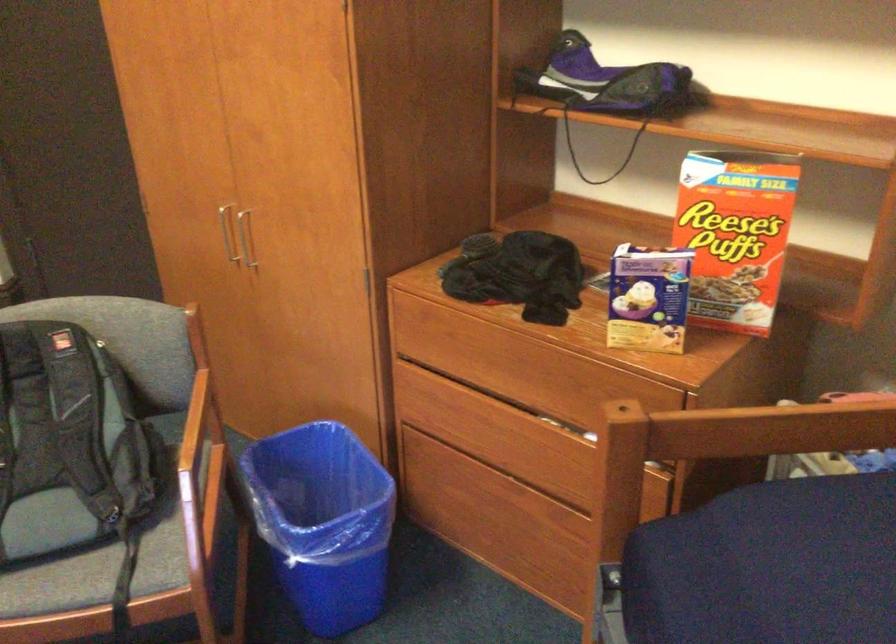
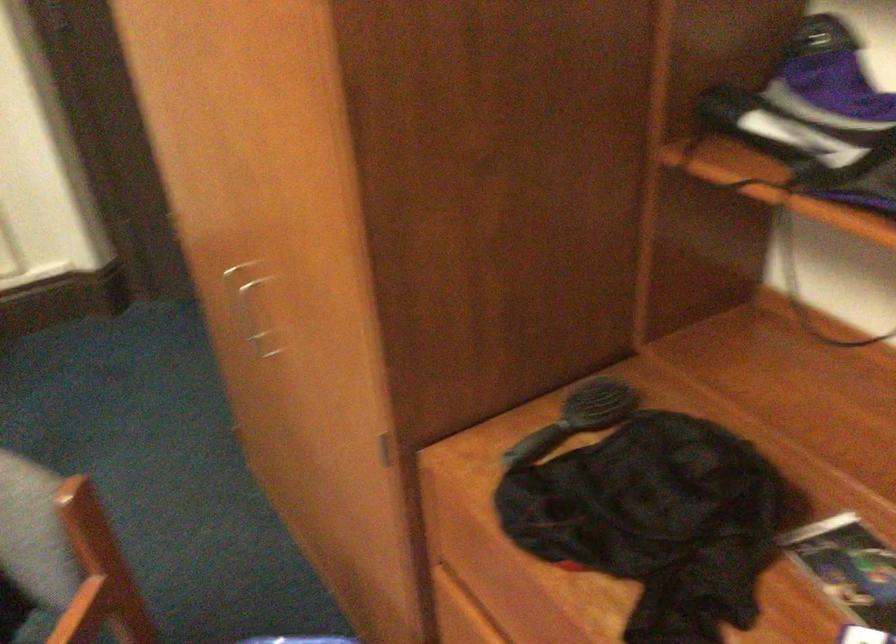
Question: Based on the continuous images, in which direction is the camera rotating? Reply with the corresponding letter.

Choices:
 (A) Left
 (B) Right
 (C) Up
 (D) Down

Answer: (A)